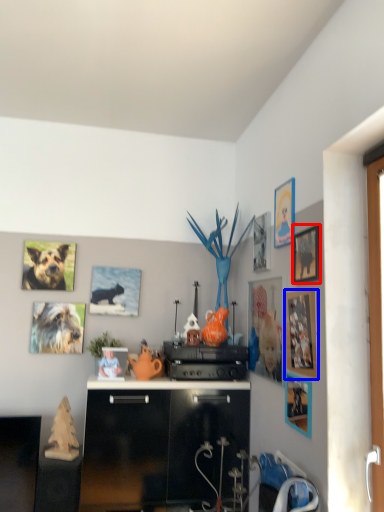
Question: Among these objects, which one is nearest to the camera, picture frame (highlighted by a red box) or picture frame (highlighted by a blue box)?

Choices:
 (A) picture frame
 (B) picture frame

Answer: (B)